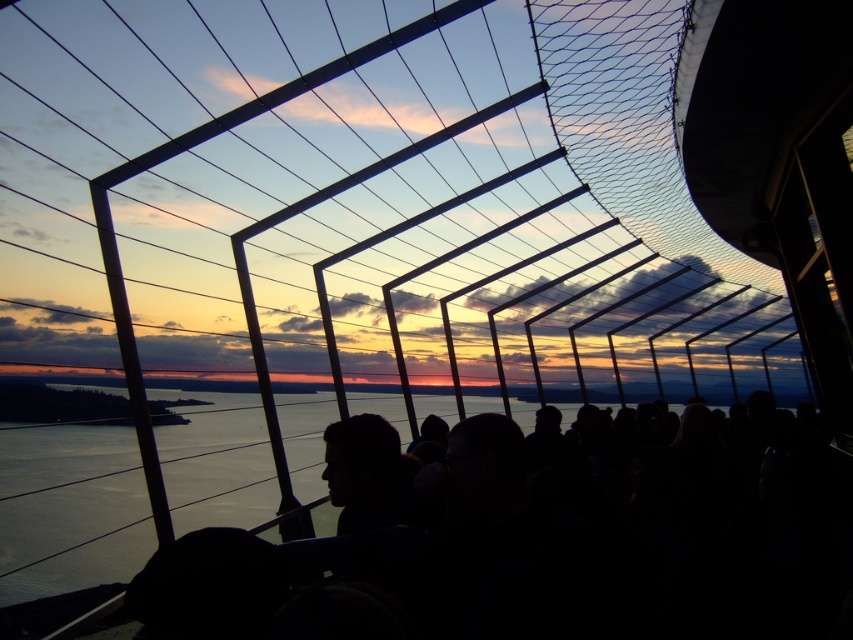
Is transparent glass water at lower left thinner than dark hair at center?

In fact, transparent glass water at lower left might be wider than dark hair at center.

Is transparent glass water at lower left taller than dark hair at center?

Indeed, transparent glass water at lower left has a greater height compared to dark hair at center.

What do you see at coordinates (68, 509) in the screenshot? I see `transparent glass water at lower left` at bounding box center [68, 509].

Locate an element on the screen. transparent glass water at lower left is located at coordinates (x=68, y=509).